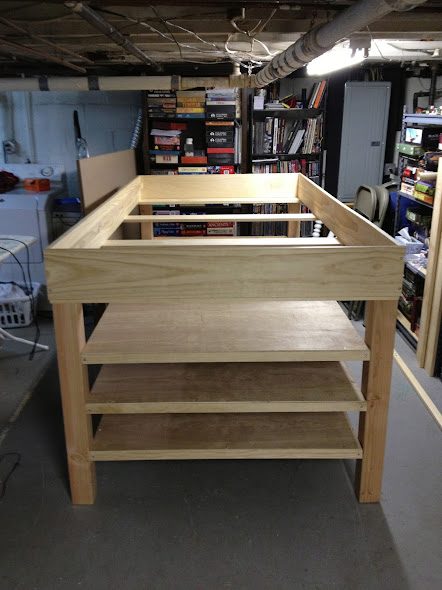
Image resolution: width=442 pixels, height=590 pixels. I want to click on basket, so click(x=25, y=311).